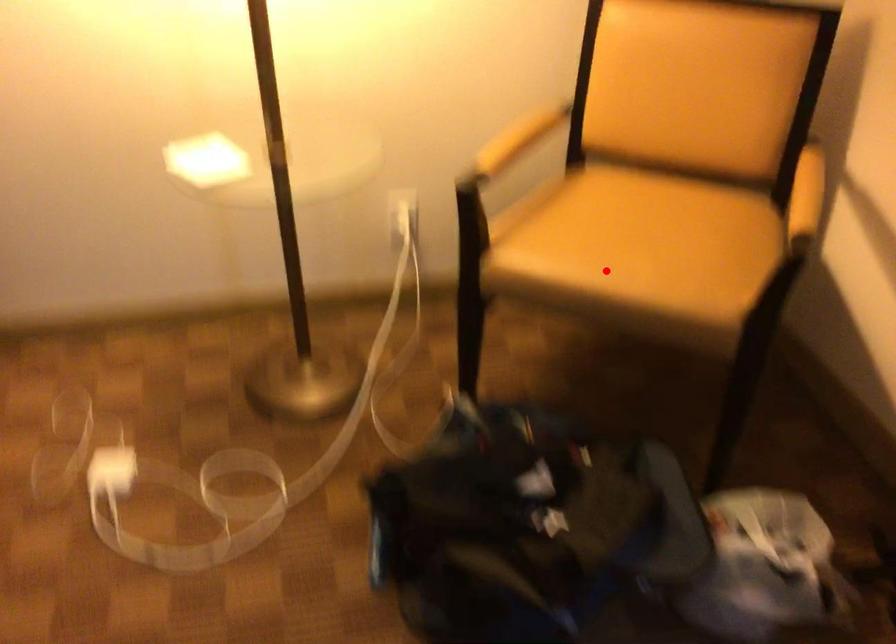
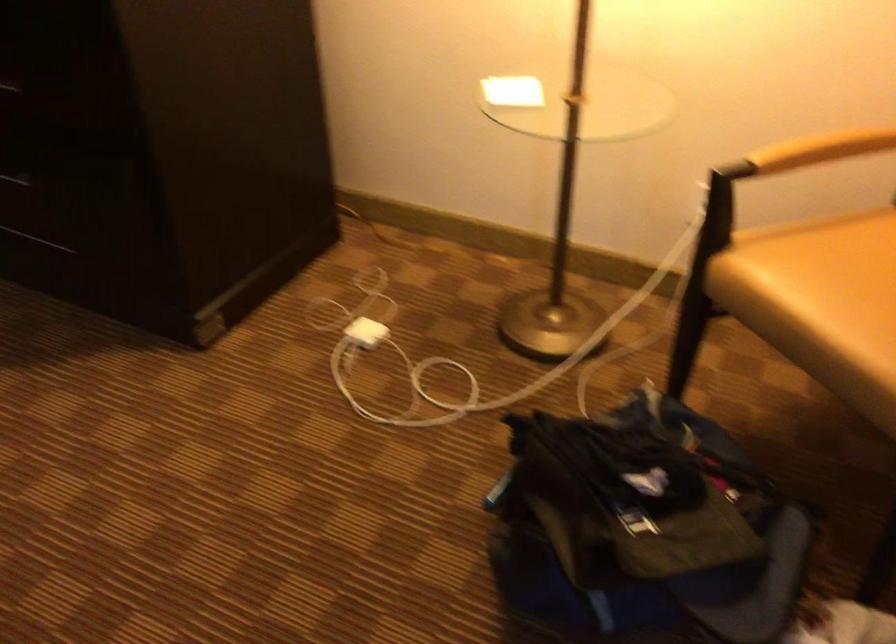
Locate, in the second image, the point that corresponds to the highlighted location in the first image.

(821, 303)